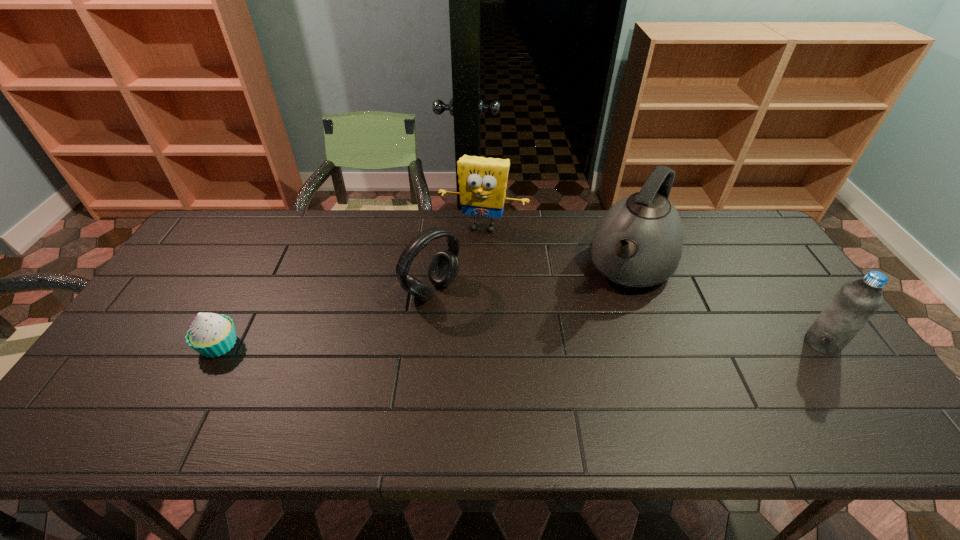
Where is `free space on the desktop that is between the shortest object and the rightmost object and is positioned on the earcups of the second shortest object`? free space on the desktop that is between the shortest object and the rightmost object and is positioned on the earcups of the second shortest object is located at coordinates (507, 343).

The image size is (960, 540). I want to click on vacant space on the desktop that is between the leftmost object and the rightmost object and is positioned at the spout of the kettle, so click(x=587, y=343).

Locate an element on the screen. free space on the desktop that is between the shortest object and the water bottle and is positioned on the face of the sponge is located at coordinates (446, 344).